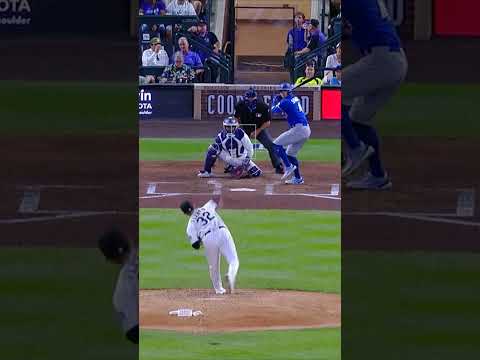
Image resolution: width=480 pixels, height=360 pixels. Identify the location of pitcher. (208, 225).